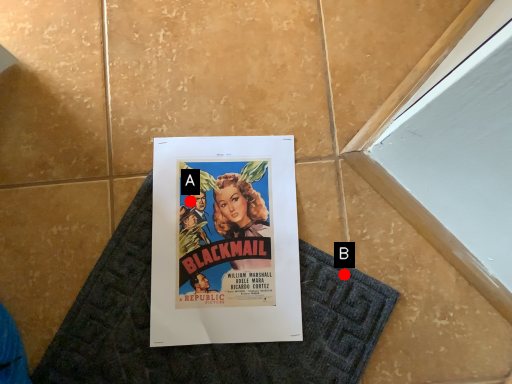
Question: Two points are circled on the image, labeled by A and B beside each circle. Which point is closer to the camera?

Choices:
 (A) A is closer
 (B) B is closer

Answer: (B)